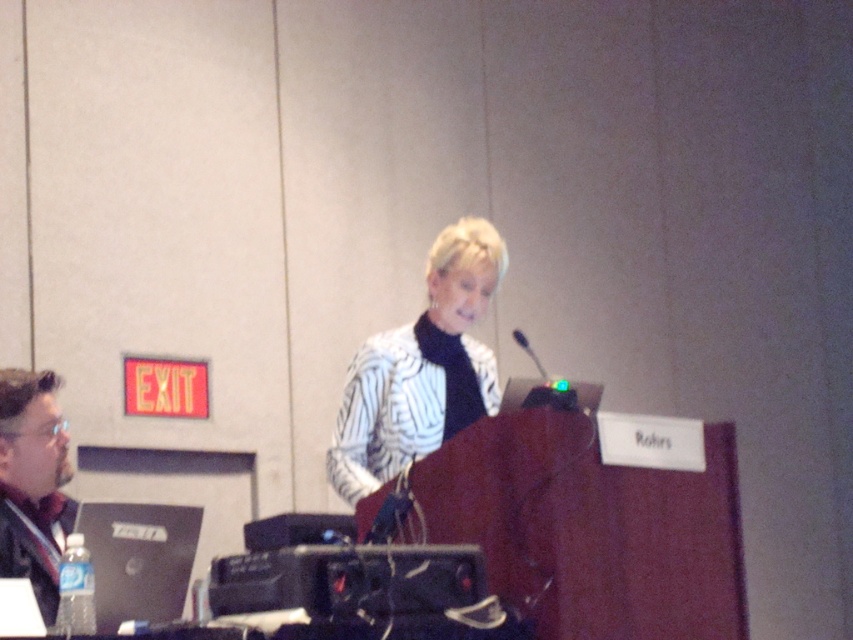
You are attending a conference and need to locate the speaker wearing the white textured blazer at center. Based on the coordinates provided, can you determine if the blazer is positioned closer to the podium or the seated individual with the laptop?

The white textured blazer at center is located at point 0.577 on the x and 0.495 on the y, which places it at the center of the image. Since the podium is in the foreground and the seated individual is to the left, the blazer is likely positioned closer to the podium where the speaker is standing.

You are a photographer at the event and need to take a photo that includes both the white textured blazer at center and the matte black laptop at left. Will the laptop be visible in the photo if you position yourself directly in front of the podium?

The matte black laptop at left is behind the white textured blazer at center, so it will not be visible in the photo if you position yourself directly in front of the podium.

You are standing in the conference room and want to know if the point at coordinate (379, 436) is closer to you than the point at (70, 467). Can you determine this based on the image?

Point (379, 436) is further to the camera than point (70, 467), so no, it is not closer to you.